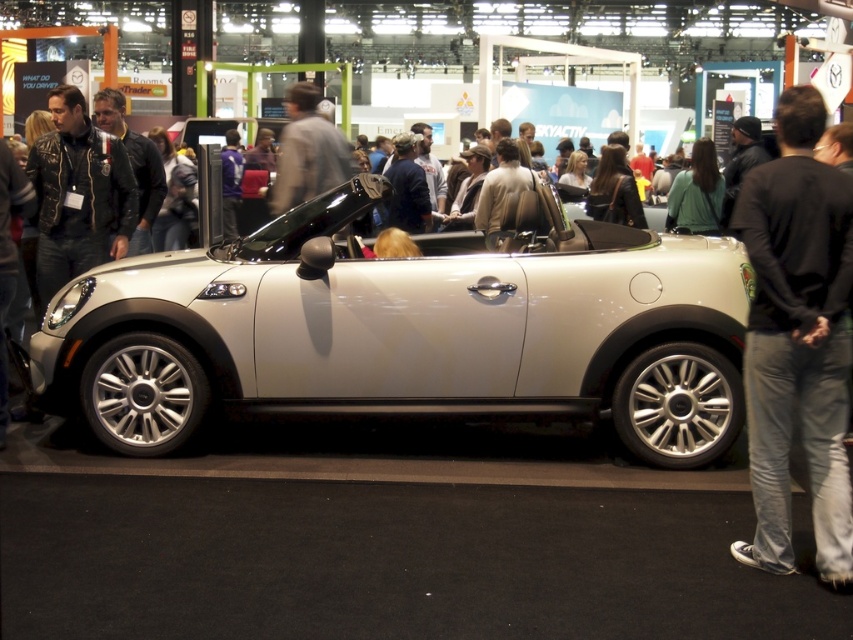
In the scene shown: Measure the distance between satin silver car at center and camera.

The distance of satin silver car at center from camera is 14.97 feet.

Locate an element on the screen. satin silver car at center is located at coordinates (405, 333).

Where is `satin silver car at center`? The width and height of the screenshot is (853, 640). satin silver car at center is located at coordinates (405, 333).

Is dark gray jeans at right bigger than leather jacket at left?

Result: Yes.

Between dark gray jeans at right and leather jacket at left, which one appears on the right side from the viewer's perspective?

dark gray jeans at right

Is point (833, 173) positioned behind point (96, 202)?

No, (833, 173) is in front of (96, 202).

Locate an element on the screen. dark gray jeans at right is located at coordinates (x=798, y=340).

Who is shorter, satin silver car at center or leather jacket at left?

leather jacket at left

Between point (573, 369) and point (96, 134), which one is positioned behind?

Positioned behind is point (96, 134).

This screenshot has height=640, width=853. In order to click on satin silver car at center in this screenshot , I will do `click(405, 333)`.